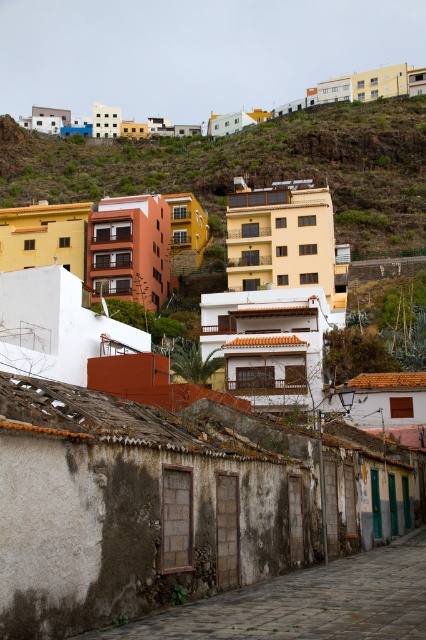
Question: Which object appears farthest from the camera in this image?

Choices:
 (A) rusty stone alley at lower center
 (B) yellow matte building at upper center
 (C) pastel painted houses at upper left

Answer: (C)

Question: Considering the relative positions of yellow matte building at upper center and rusty stone alley at lower center in the image provided, where is yellow matte building at upper center located with respect to rusty stone alley at lower center?

Choices:
 (A) below
 (B) above

Answer: (B)

Question: Which of the following is the closest to the observer?

Choices:
 (A) yellow matte building at upper center
 (B) pastel painted houses at upper left

Answer: (A)

Question: Does yellow matte building at upper center have a greater width compared to rusty stone alley at lower center?

Choices:
 (A) yes
 (B) no

Answer: (A)

Question: Which point is farther to the camera?

Choices:
 (A) pos(239,172)
 (B) pos(172,627)

Answer: (A)

Question: Does rusty stone alley at lower center appear on the right side of pastel painted houses at upper left?

Choices:
 (A) no
 (B) yes

Answer: (B)